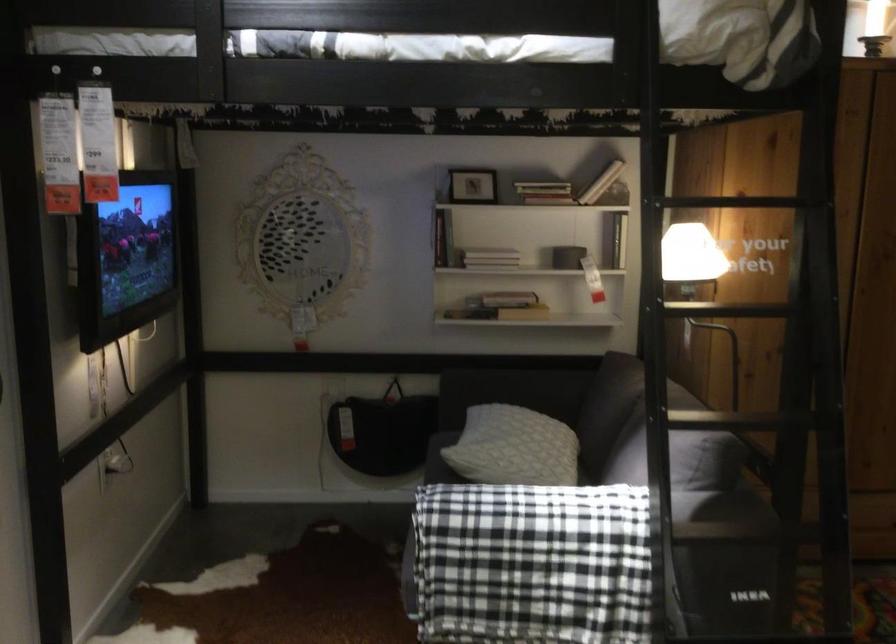
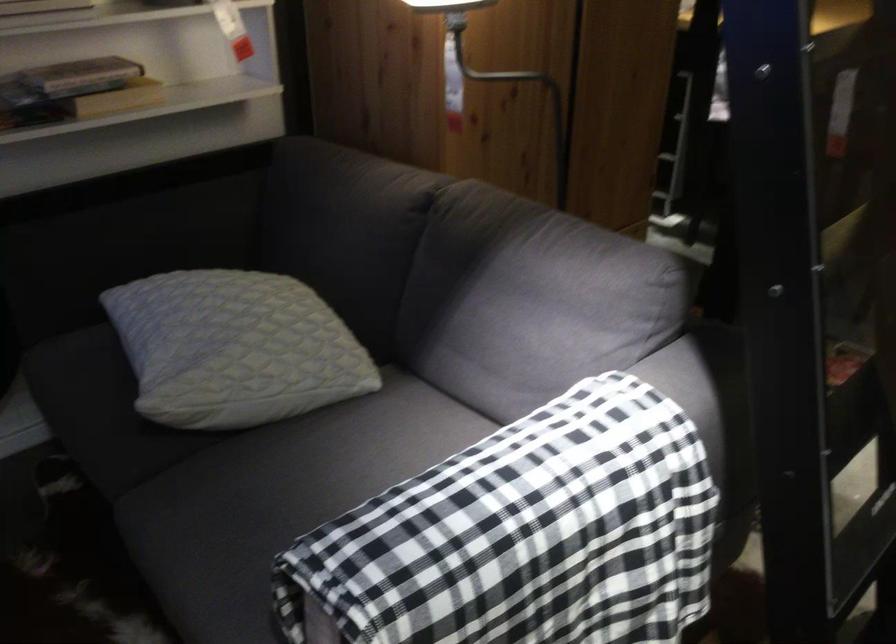
Question: I am providing you with two images of the same scene from different viewpoints. Which of the following objects are not visible in image2?

Choices:
 (A) white patterned pillow
 (B) sofa armrest
 (C) sofa sitting surface
 (D) none of these

Answer: (D)